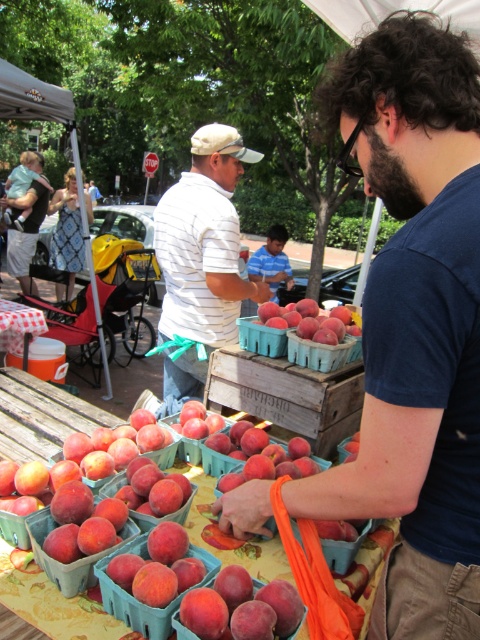
Question: Is striped cotton shirt at center positioned before matte plastic basket at center?

Choices:
 (A) no
 (B) yes

Answer: (A)

Question: Which point appears farthest from the camera in this image?

Choices:
 (A) [2, 342]
 (B) [199, 148]
 (C) [262, 257]

Answer: (C)

Question: Is matte plastic peaches at center positioned at the back of matte plastic basket at center?

Choices:
 (A) yes
 (B) no

Answer: (A)

Question: Which of the following is the farthest from the observer?

Choices:
 (A) (346, 324)
 (B) (21, 340)
 (C) (6, 403)

Answer: (B)

Question: Which point is farther from the camera taking this photo?

Choices:
 (A) (243, 333)
 (B) (195, 378)

Answer: (B)

Question: Is peachy matte peaches at center to the right of striped cotton shirt at center from the viewer's perspective?

Choices:
 (A) no
 (B) yes

Answer: (B)